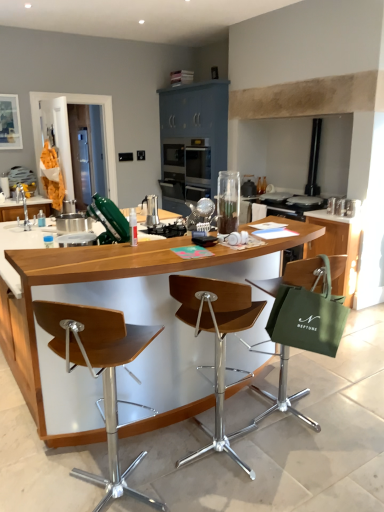
Find the location of a particular element. This screenshot has width=384, height=512. vacant location below green fabric shopping bag at right (from a real-world perspective) is located at coordinates (309, 436).